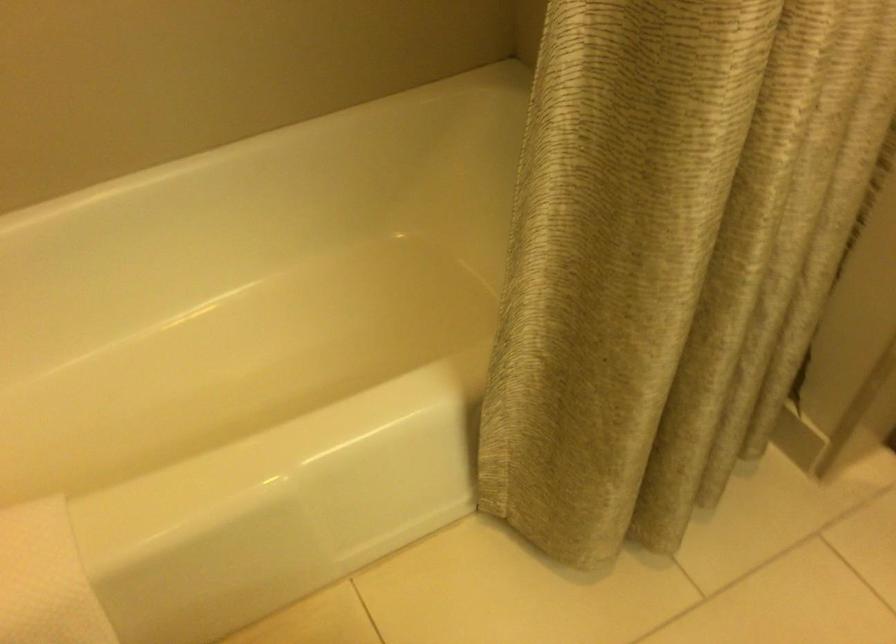
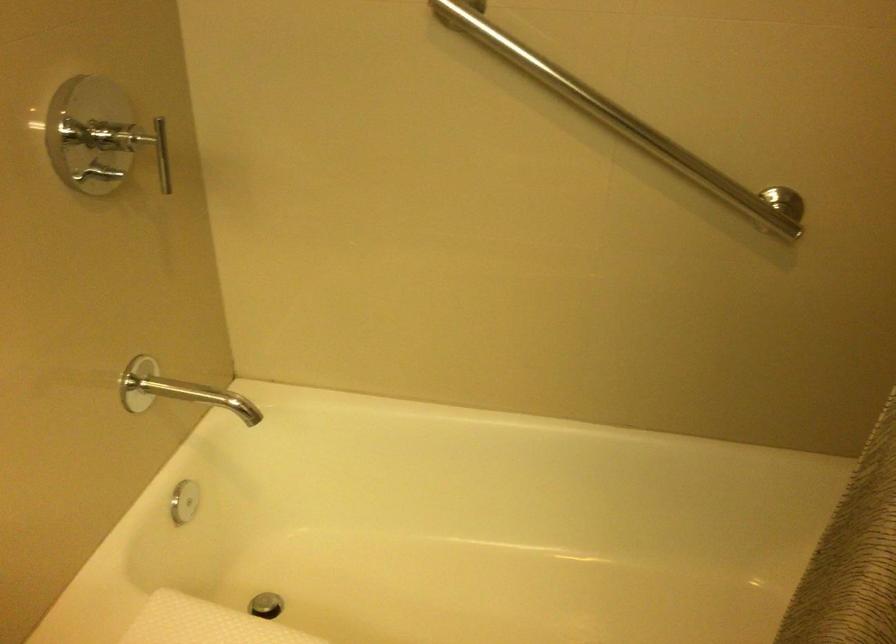
Question: The camera is either moving clockwise (left) or counter-clockwise (right) around the object. The first image is from the beginning of the video and the second image is from the end. Is the camera moving left or right when shooting the video?

Choices:
 (A) Left
 (B) Right

Answer: (B)